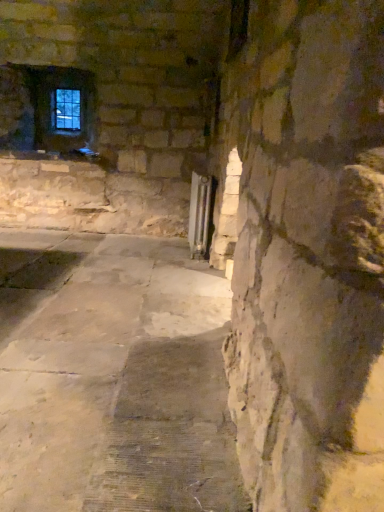
What do you see at coordinates (66, 110) in the screenshot? Image resolution: width=384 pixels, height=512 pixels. I see `clear glass window at upper left` at bounding box center [66, 110].

Locate an element on the screen. The height and width of the screenshot is (512, 384). clear glass window at upper left is located at coordinates (66, 110).

Measure the distance between clear glass window at upper left and camera.

A distance of 4.57 meters exists between clear glass window at upper left and camera.

Describe the element at coordinates (200, 213) in the screenshot. I see `silver metallic radiator at center-right` at that location.

Find the location of a particular element. The height and width of the screenshot is (512, 384). silver metallic radiator at center-right is located at coordinates (200, 213).

Measure the distance between silver metallic radiator at center-right and camera.

3.37 meters.

Where is `clear glass window at upper left`? This screenshot has height=512, width=384. clear glass window at upper left is located at coordinates (66, 110).

Considering the positions of objects silver metallic radiator at center-right and clear glass window at upper left in the image provided, who is more to the left, silver metallic radiator at center-right or clear glass window at upper left?

Positioned to the left is clear glass window at upper left.

Which object is closer to the camera, silver metallic radiator at center-right or clear glass window at upper left?

silver metallic radiator at center-right is in front.

Is point (204, 250) positioned after point (72, 104)?

That is False.

From the image's perspective, between silver metallic radiator at center-right and clear glass window at upper left, who is located below?

silver metallic radiator at center-right.

From a real-world perspective, which is physically below, silver metallic radiator at center-right or clear glass window at upper left?

silver metallic radiator at center-right, from a real-world perspective.

Which of these two, silver metallic radiator at center-right or clear glass window at upper left, is thinner?

Thinner between the two is clear glass window at upper left.

Considering the relative sizes of silver metallic radiator at center-right and clear glass window at upper left in the image provided, is silver metallic radiator at center-right taller than clear glass window at upper left?

Correct, silver metallic radiator at center-right is much taller as clear glass window at upper left.

Which of these two, silver metallic radiator at center-right or clear glass window at upper left, is smaller?

Smaller between the two is clear glass window at upper left.

Is clear glass window at upper left inside silver metallic radiator at center-right?

No, clear glass window at upper left is located outside of silver metallic radiator at center-right.

Is silver metallic radiator at center-right far away from clear glass window at upper left?

Yes, silver metallic radiator at center-right and clear glass window at upper left are quite far apart.

Is silver metallic radiator at center-right looking in the opposite direction of clear glass window at upper left?

No, clear glass window at upper left is not at the back of silver metallic radiator at center-right.

I want to click on window frame on the left side of silver metallic radiator at center-right, so click(x=66, y=110).

In the scene shown: Considering the relative positions of clear glass window at upper left and silver metallic radiator at center-right in the image provided, is clear glass window at upper left to the left or to the right of silver metallic radiator at center-right?

In the image, clear glass window at upper left appears on the left side of silver metallic radiator at center-right.

Relative to silver metallic radiator at center-right, is clear glass window at upper left in front or behind?

In the image, clear glass window at upper left appears behind silver metallic radiator at center-right.

Between point (70, 104) and point (191, 251), which one is positioned behind?

The point (70, 104) is more distant.

Based on the photo, from the image's perspective, relative to silver metallic radiator at center-right, is clear glass window at upper left above or below?

clear glass window at upper left is situated higher than silver metallic radiator at center-right in the image.

From a real-world perspective, between clear glass window at upper left and silver metallic radiator at center-right, who is vertically lower?

silver metallic radiator at center-right is physically lower.

Is clear glass window at upper left wider than silver metallic radiator at center-right?

No, clear glass window at upper left is not wider than silver metallic radiator at center-right.

Considering the relative sizes of clear glass window at upper left and silver metallic radiator at center-right in the image provided, is clear glass window at upper left shorter than silver metallic radiator at center-right?

Correct, clear glass window at upper left is not as tall as silver metallic radiator at center-right.

Is clear glass window at upper left smaller than silver metallic radiator at center-right?

Yes, clear glass window at upper left is smaller than silver metallic radiator at center-right.

Which is correct: clear glass window at upper left is inside silver metallic radiator at center-right, or outside of it?

clear glass window at upper left lies outside silver metallic radiator at center-right.

Is clear glass window at upper left next to silver metallic radiator at center-right?

No, clear glass window at upper left is not beside silver metallic radiator at center-right.

Could you tell me if clear glass window at upper left is turned towards silver metallic radiator at center-right?

No, clear glass window at upper left is not aimed at silver metallic radiator at center-right.

The width and height of the screenshot is (384, 512). I want to click on elevator lying on the right of clear glass window at upper left, so click(x=200, y=213).

The width and height of the screenshot is (384, 512). I want to click on window frame that is on the left side of silver metallic radiator at center-right, so click(66, 110).

Where is `window frame that is above the silver metallic radiator at center-right (from the image's perspective)`? The width and height of the screenshot is (384, 512). window frame that is above the silver metallic radiator at center-right (from the image's perspective) is located at coordinates (66, 110).